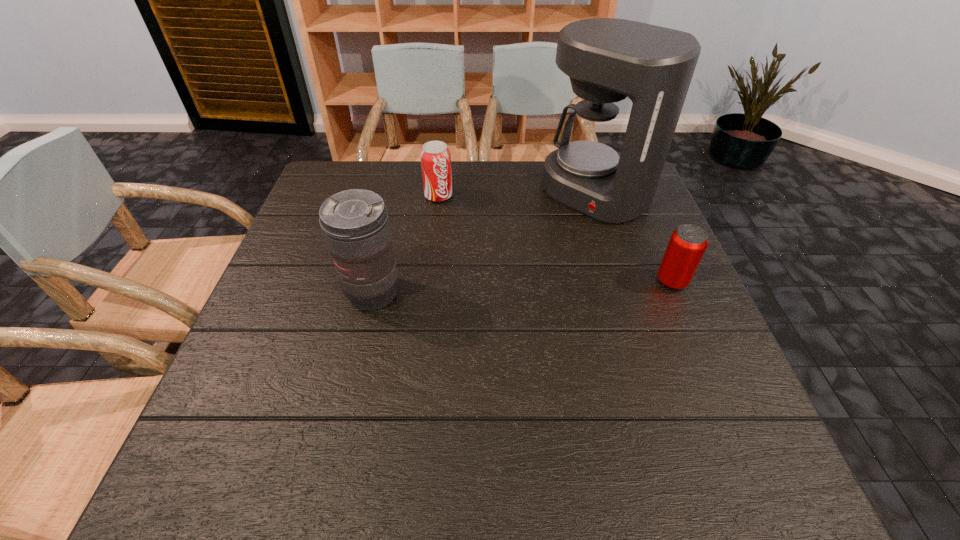
You are a GUI agent. You are given a task and a screenshot of the screen. Output one action in this format:
    pyautogui.click(x=<x>, y=<y>)
    Task: Click on the vacant space at the left edge of the desktop
    
    Given the screenshot: What is the action you would take?
    point(296,254)

Where is `vacant space at the right edge of the desktop`? vacant space at the right edge of the desktop is located at coordinates (651, 260).

Where is `free region at the far left corner of the desktop`? free region at the far left corner of the desktop is located at coordinates (348, 168).

Locate an element on the screen. This screenshot has height=540, width=960. vacant space at the near right corner of the desktop is located at coordinates (662, 423).

You are a GUI agent. You are given a task and a screenshot of the screen. Output one action in this format:
    pyautogui.click(x=<x>, y=<y>)
    Task: Click on the vacant area that lies between the coffee maker and the leftmost object
    This screenshot has height=540, width=960.
    Given the screenshot: What is the action you would take?
    pyautogui.click(x=485, y=244)

I want to click on empty space between the can and the second object from left to right, so click(x=555, y=239).

Identify the location of empty location between the can and the telephoto lens. Image resolution: width=960 pixels, height=540 pixels. (522, 287).

I want to click on empty location between the tallest object and the can, so [635, 237].

The image size is (960, 540). I want to click on free point between the third object from right to left and the telephoto lens, so click(406, 245).

You are a GUI agent. You are given a task and a screenshot of the screen. Output one action in this format:
    pyautogui.click(x=<x>, y=<y>)
    Task: Click on the free space that is in between the can and the tallest object
    The image size is (960, 540).
    Given the screenshot: What is the action you would take?
    pyautogui.click(x=635, y=237)